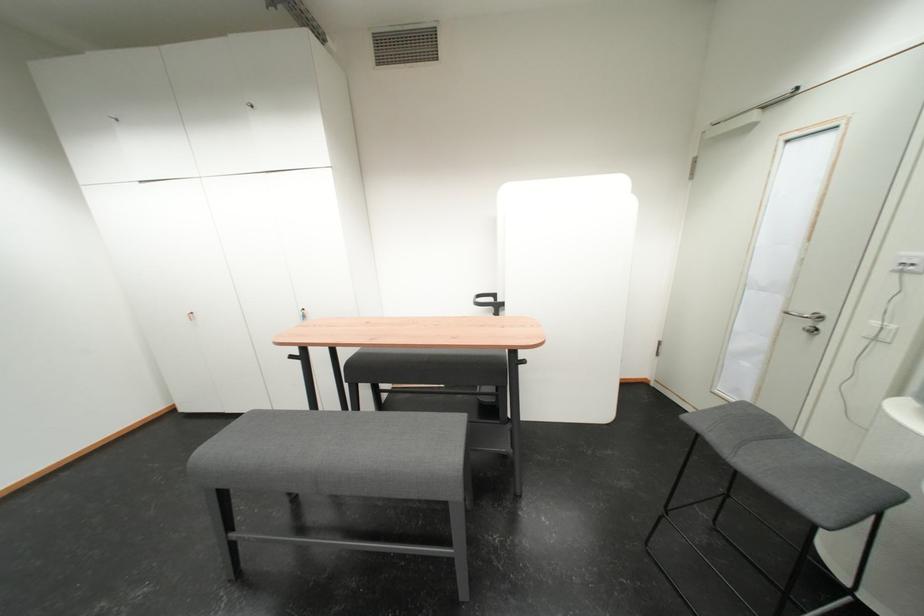
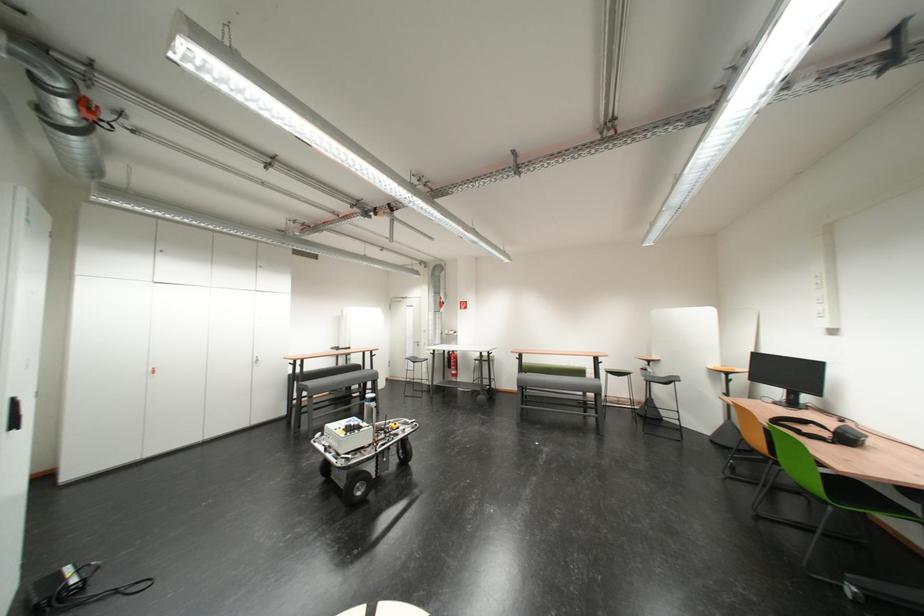
Where in the second image is the point corresponding to point (749, 330) from the first image?

(419, 351)